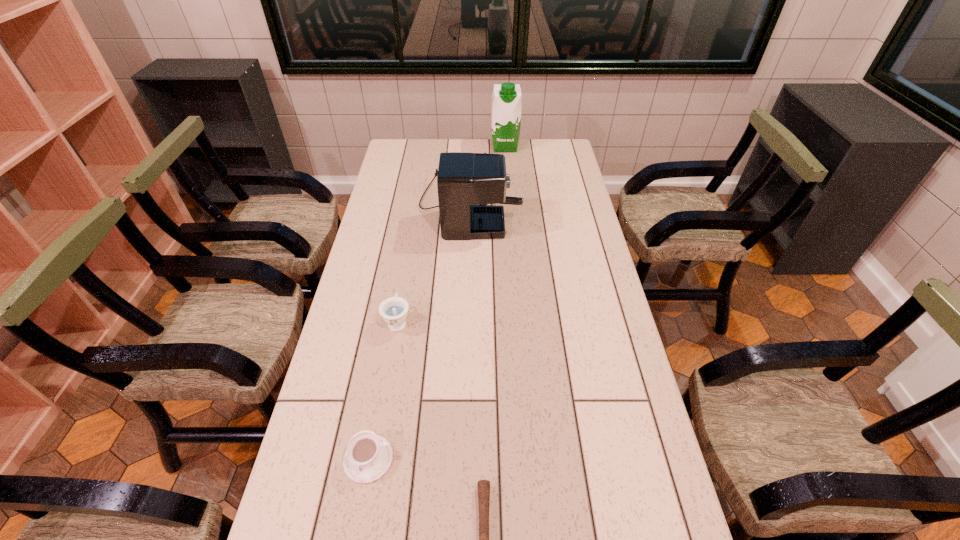
Image resolution: width=960 pixels, height=540 pixels. I want to click on object identified as the fourth closest to the third tallest object, so click(506, 98).

Where is `free space in the image that satisfies the following two spatial constraints: 1. on the front-facing side of the soya milk; 2. on the front-facing side of the fourth shortest object`? free space in the image that satisfies the following two spatial constraints: 1. on the front-facing side of the soya milk; 2. on the front-facing side of the fourth shortest object is located at coordinates (510, 204).